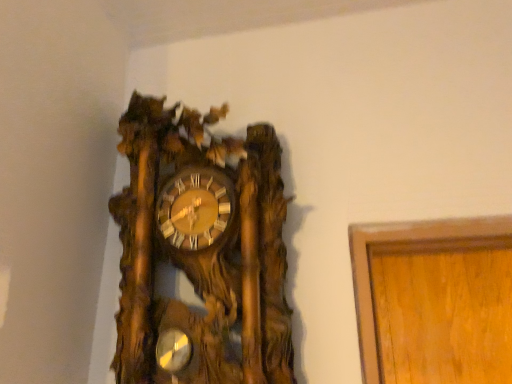
Where is `wooden carved clock at upper left`? This screenshot has width=512, height=384. wooden carved clock at upper left is located at coordinates (201, 251).

What do you see at coordinates (201, 251) in the screenshot?
I see `wooden carved clock at upper left` at bounding box center [201, 251].

Measure the distance between point (155, 218) and camera.

They are 33.46 inches apart.

In order to click on wooden carved clock at upper left in this screenshot , I will do `click(201, 251)`.